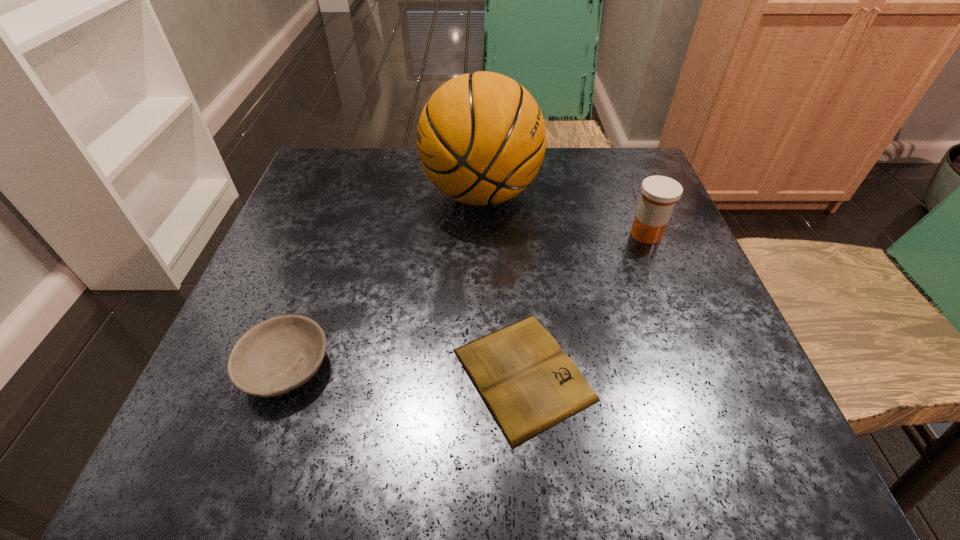
Where is `vacant space at the far edge of the desktop`? vacant space at the far edge of the desktop is located at coordinates (532, 206).

Identify the location of vacant space at the near edge. (341, 426).

Image resolution: width=960 pixels, height=540 pixels. I want to click on vacant space at the left edge, so click(276, 308).

You are a GUI agent. You are given a task and a screenshot of the screen. Output one action in this format:
    pyautogui.click(x=<x>, y=<y>)
    Task: Click on the vacant space at the right edge
    This screenshot has width=960, height=540.
    Given the screenshot: What is the action you would take?
    pyautogui.click(x=641, y=299)

You are a GUI agent. You are given a task and a screenshot of the screen. Output one action in this format:
    pyautogui.click(x=<x>, y=<y>)
    Task: Click on the vacant space at the far left corner
    Image resolution: width=960 pixels, height=540 pixels.
    Given the screenshot: What is the action you would take?
    (x=333, y=193)

Where is `vacant space at the far right corner of the desktop`? vacant space at the far right corner of the desktop is located at coordinates (599, 166).

Where is `vacant area at the near right corner of the desktop`? vacant area at the near right corner of the desktop is located at coordinates (660, 409).

The image size is (960, 540). Find the location of `empty location between the book and the tallest object`. empty location between the book and the tallest object is located at coordinates (502, 284).

The image size is (960, 540). Identify the location of vacant point located between the basketball and the bowl. (384, 281).

You are a GUI agent. You are given a task and a screenshot of the screen. Output one action in this format:
    pyautogui.click(x=<x>, y=<y>)
    Task: Click on the free spot between the tallest object and the book
    This screenshot has width=960, height=540.
    Given the screenshot: What is the action you would take?
    pyautogui.click(x=502, y=284)